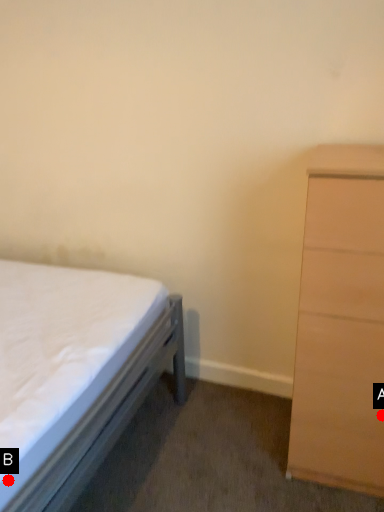
Question: Two points are circled on the image, labeled by A and B beside each circle. Which of the following is the closest to the observer?

Choices:
 (A) A is closer
 (B) B is closer

Answer: (B)